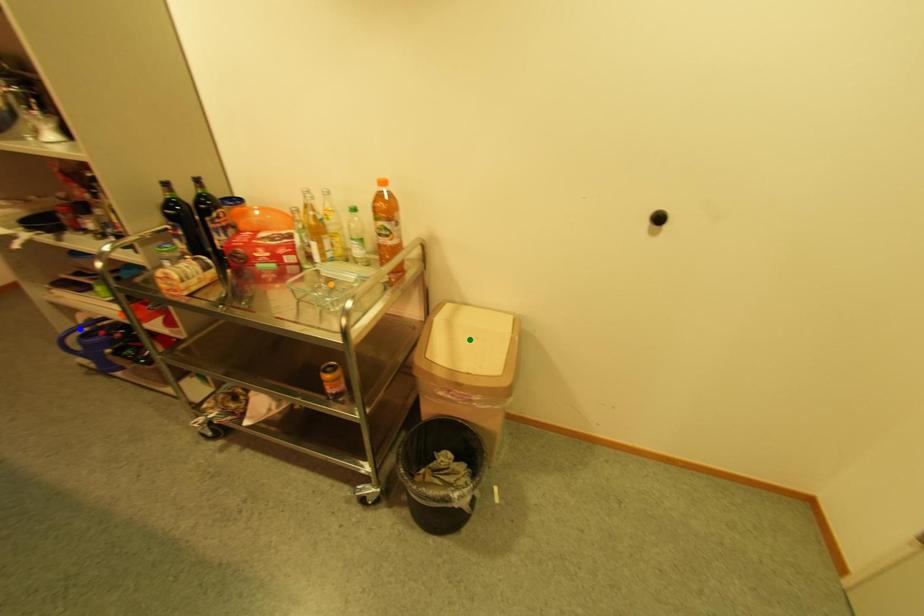
Order these from nearest to farthest:
- orange point
- green point
- blue point

1. blue point
2. green point
3. orange point